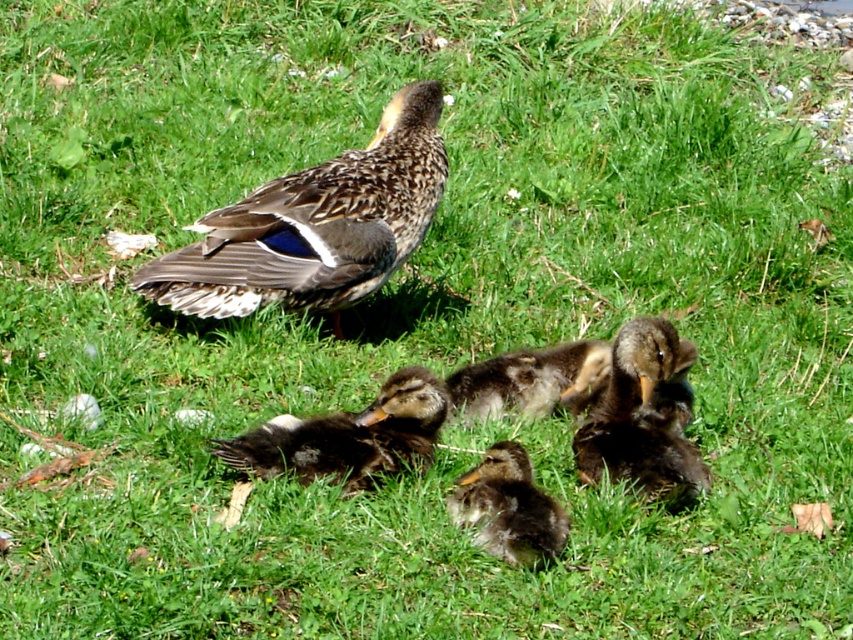
You are standing at the origin point in the image. Which of the two points, point (669, 384) or point (537, 532), is farther away from you?

Point (669, 384) is behind point (537, 532), so it is farther away from you.